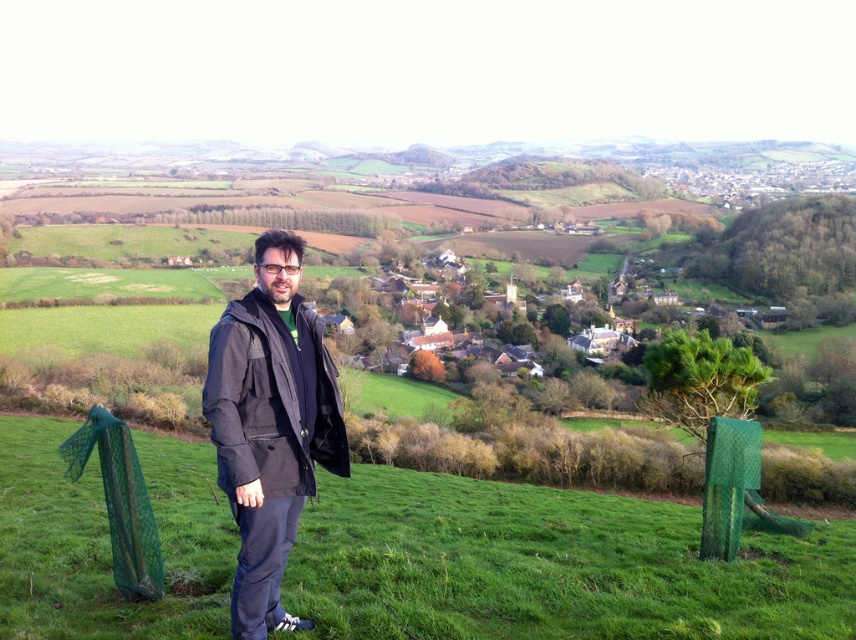
You are standing at the point marked as point [774,540] in the image. You want to walk to the other point which is 14.60 meters away. The path is flat and clear. How many steps would you need to take if each of your steps is 0.75 meters long?

The distance between the two points is 14.60 meters. Each step covers 0.75 meters. To find the number of steps needed, divide the total distance by the step length. 14.60 divided by 0.75 equals approximately 19.47 steps. Since you can only take whole steps, you would need to take 20 steps to cover the distance.

From the picture: You are a hiker who wants to take a photo of the countryside. You notice the green grassy at center and the dark gray fabric jacket at center. Which object is wider in the scene?

The green grassy at center is wider than the dark gray fabric jacket at center.